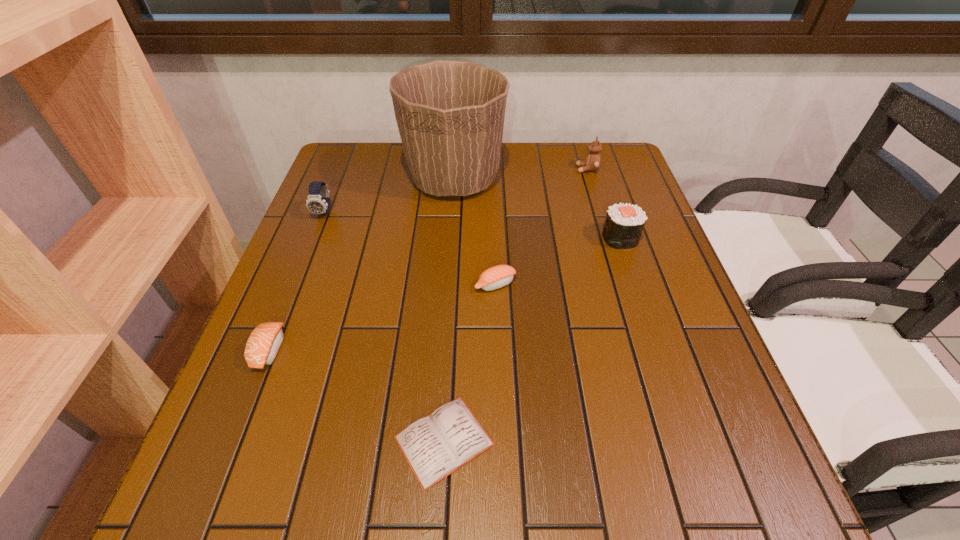
Locate an element on the screen. vacant space that is in between the second sushi from left to right and the teddy bear is located at coordinates (541, 227).

Locate an element on the screen. This screenshot has width=960, height=540. free space that is in between the second sushi from left to right and the diary is located at coordinates (469, 362).

Where is `free space between the third nearest object and the diary`? free space between the third nearest object and the diary is located at coordinates (469, 362).

The image size is (960, 540). Identify the location of object that is the third closest to the second nearest object. (x=498, y=276).

Locate an element on the screen. object that ranks as the sixth closest to the leftmost sushi is located at coordinates (592, 163).

Identify which sushi is the third nearest to the watch. Please provide its 2D coordinates. Your answer should be formatted as a tuple, i.e. [(x, y)], where the tuple contains the x and y coordinates of a point satisfying the conditions above.

[(624, 223)]

Locate which sushi ranks in proximity to the sixth farthest object. Please provide its 2D coordinates. Your answer should be formatted as a tuple, i.e. [(x, y)], where the tuple contains the x and y coordinates of a point satisfying the conditions above.

[(498, 276)]

Find the location of a particular element. This screenshot has height=540, width=960. free space that satisfies the following two spatial constraints: 1. on the back side of the fourth nearest object; 2. on the right side of the second nearest sushi is located at coordinates (493, 238).

Image resolution: width=960 pixels, height=540 pixels. Find the location of `blank space that satisfies the following two spatial constraints: 1. on the front-facing side of the teddy bear; 2. on the face of the watch`. blank space that satisfies the following two spatial constraints: 1. on the front-facing side of the teddy bear; 2. on the face of the watch is located at coordinates (600, 212).

At what (x,y) coordinates should I click in order to perform the action: click on vacant area that satisfies the following two spatial constraints: 1. on the back side of the leftmost sushi; 2. on the right side of the flowerpot. Please return your answer as a coordinate pair (x, y). Looking at the image, I should click on (337, 179).